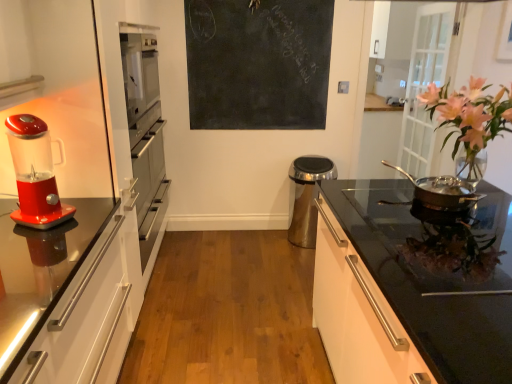
Question: Should I look upward or downward to see black chalkboard at upper center?

Choices:
 (A) down
 (B) up

Answer: (B)

Question: Does shiny silver pan at right have a greater width compared to black glossy cabinet at right?

Choices:
 (A) yes
 (B) no

Answer: (B)

Question: Does shiny silver pan at right have a lesser height compared to black glossy cabinet at right?

Choices:
 (A) yes
 (B) no

Answer: (A)

Question: Can you confirm if shiny silver pan at right is positioned to the right of black glossy cabinet at right?

Choices:
 (A) yes
 (B) no

Answer: (A)

Question: Is shiny silver pan at right aimed at black glossy cabinet at right?

Choices:
 (A) yes
 (B) no

Answer: (B)

Question: Is shiny silver pan at right far from black glossy cabinet at right?

Choices:
 (A) yes
 (B) no

Answer: (B)

Question: Is shiny silver pan at right further to camera compared to black glossy cabinet at right?

Choices:
 (A) yes
 (B) no

Answer: (A)

Question: Considering the relative sizes of black chalkboard at upper center and shiny plastic blender at left in the image provided, is black chalkboard at upper center thinner than shiny plastic blender at left?

Choices:
 (A) no
 (B) yes

Answer: (B)

Question: From a real-world perspective, is black chalkboard at upper center below shiny plastic blender at left?

Choices:
 (A) no
 (B) yes

Answer: (A)

Question: From the image's perspective, would you say black chalkboard at upper center is shown under shiny plastic blender at left?

Choices:
 (A) yes
 (B) no

Answer: (B)

Question: Considering the relative sizes of black chalkboard at upper center and shiny plastic blender at left in the image provided, is black chalkboard at upper center shorter than shiny plastic blender at left?

Choices:
 (A) yes
 (B) no

Answer: (B)

Question: From the image's perspective, is black chalkboard at upper center above shiny plastic blender at left?

Choices:
 (A) no
 (B) yes

Answer: (B)

Question: Considering the relative positions of black chalkboard at upper center and shiny plastic blender at left in the image provided, is black chalkboard at upper center to the left of shiny plastic blender at left from the viewer's perspective?

Choices:
 (A) yes
 (B) no

Answer: (B)

Question: Does shiny plastic blender at left have a lesser height compared to shiny silver pan at right?

Choices:
 (A) no
 (B) yes

Answer: (A)